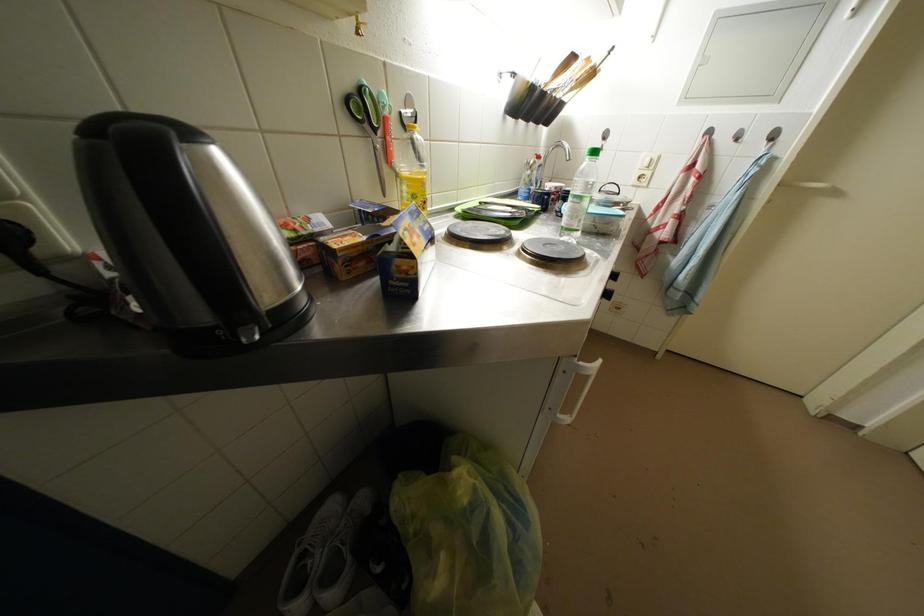
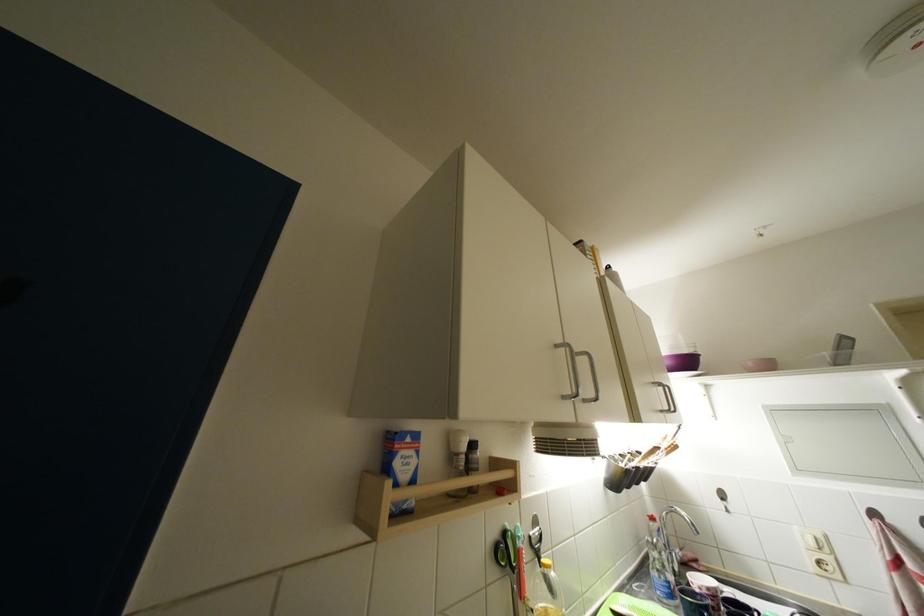
Where in the second image is the point corresponding to the point at 405,174 from the first image?

(537, 610)